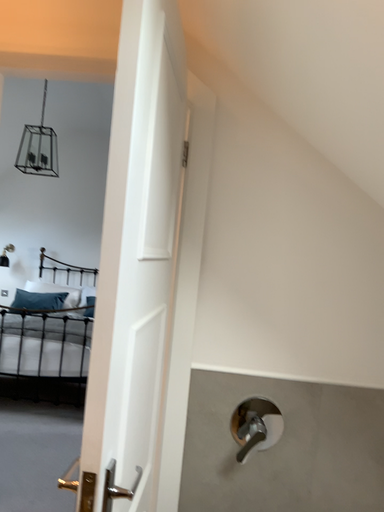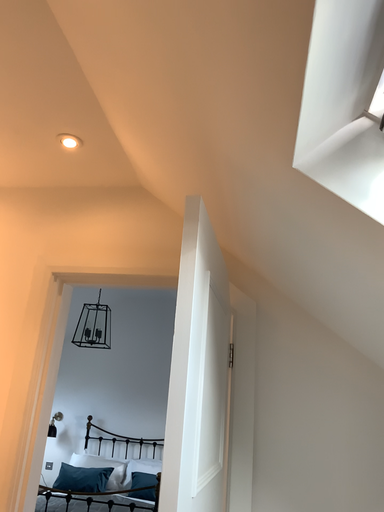
Question: Which way did the camera rotate in the video?

Choices:
 (A) rotated right
 (B) rotated left

Answer: (B)